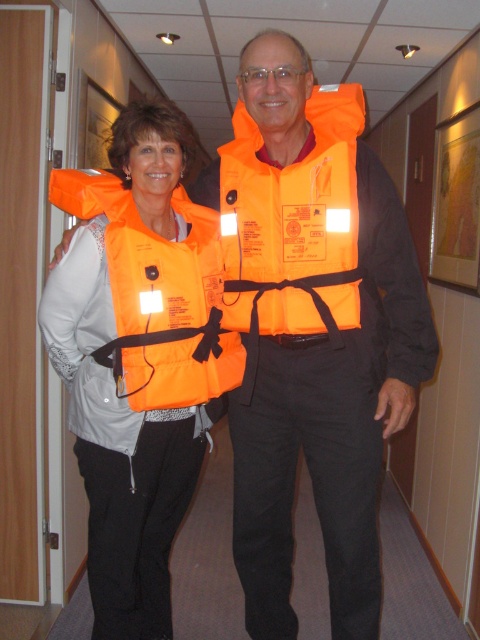
Question: Which of the following is the closest to the observer?

Choices:
 (A) (295, 173)
 (B) (121, 189)
 (C) (208, 230)

Answer: (A)

Question: Which object is closer to the camera taking this photo?

Choices:
 (A) orange fabric life jacket at left
 (B) orange fabric life jacket at center
 (C) orange matte life vest at left

Answer: (B)

Question: Is orange matte life vest at left wider than orange fabric life jacket at left?

Choices:
 (A) yes
 (B) no

Answer: (A)

Question: Which object is farther from the camera taking this photo?

Choices:
 (A) orange matte life vest at left
 (B) orange fabric life jacket at center

Answer: (A)

Question: Does orange matte life vest at left lie behind orange fabric life jacket at center?

Choices:
 (A) yes
 (B) no

Answer: (A)

Question: Is orange matte life vest at left positioned at the back of orange fabric life jacket at center?

Choices:
 (A) yes
 (B) no

Answer: (A)